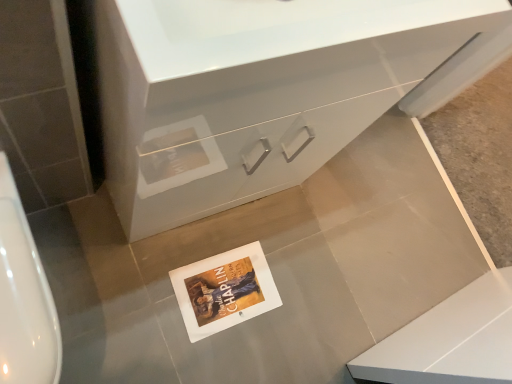
This screenshot has width=512, height=384. What are the coordinates of `vacant space that is in between white glossy cabinet at center and white paper postcard at center` in the screenshot? It's located at (231, 241).